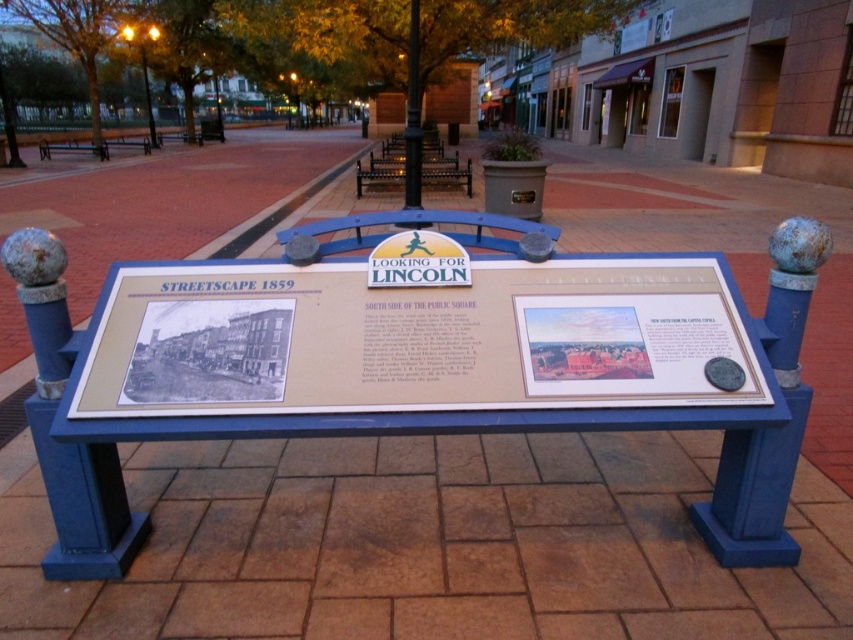
Is blue painted wood bench at left smaller than blue painted wood bench at upper left?

Yes.

Based on the photo, is blue painted wood bench at left taller than blue painted wood bench at upper left?

No.

Is point (41, 156) positioned before point (144, 136)?

That is True.

At what (x,y) coordinates should I click in order to perform the action: click on blue painted wood bench at left. Please return your answer as a coordinate pair (x, y). Image resolution: width=853 pixels, height=640 pixels. Looking at the image, I should click on (73, 148).

In the scene shown: Who is higher up, metallic dark brown bench at center or blue painted wood bench at upper left?

Positioned higher is blue painted wood bench at upper left.

Between metallic dark brown bench at center and blue painted wood bench at upper left, which one appears on the right side from the viewer's perspective?

metallic dark brown bench at center

Is point (425, 172) behind point (119, 138)?

That is False.

Locate an element on the screen. The width and height of the screenshot is (853, 640). metallic dark brown bench at center is located at coordinates (444, 166).

Between point (440, 147) and point (86, 144), which one is positioned in front?

Point (440, 147) is more forward.

This screenshot has height=640, width=853. In order to click on metallic dark brown bench at center in this screenshot , I will do `click(444, 166)`.